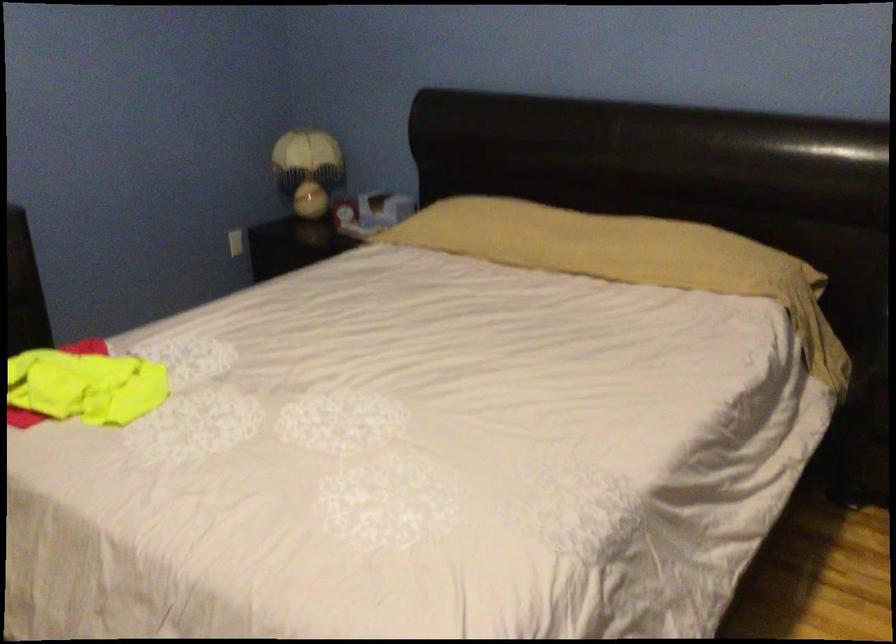
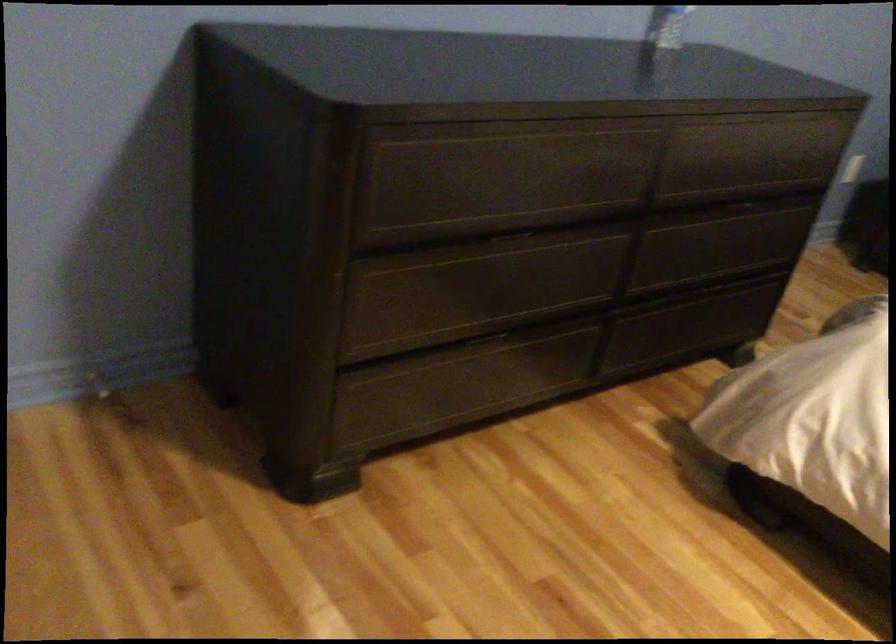
Question: Which direction would the cameraman need to move to produce the second image? Reply with the corresponding letter.

Choices:
 (A) Left
 (B) Right
 (C) Forward
 (D) Backward

Answer: (A)